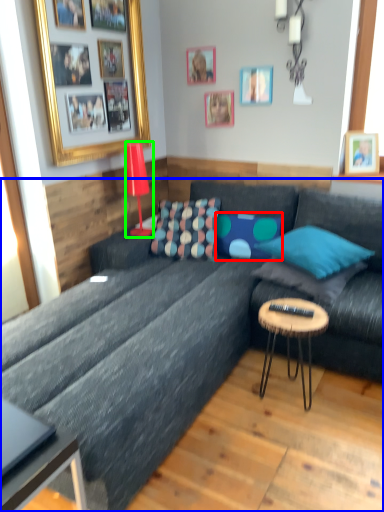
Question: Based on their relative distances, which object is nearer to pillow (highlighted by a red box)? Choose from studio couch (highlighted by a blue box) and lamp (highlighted by a green box).

Choices:
 (A) studio couch
 (B) lamp

Answer: (B)